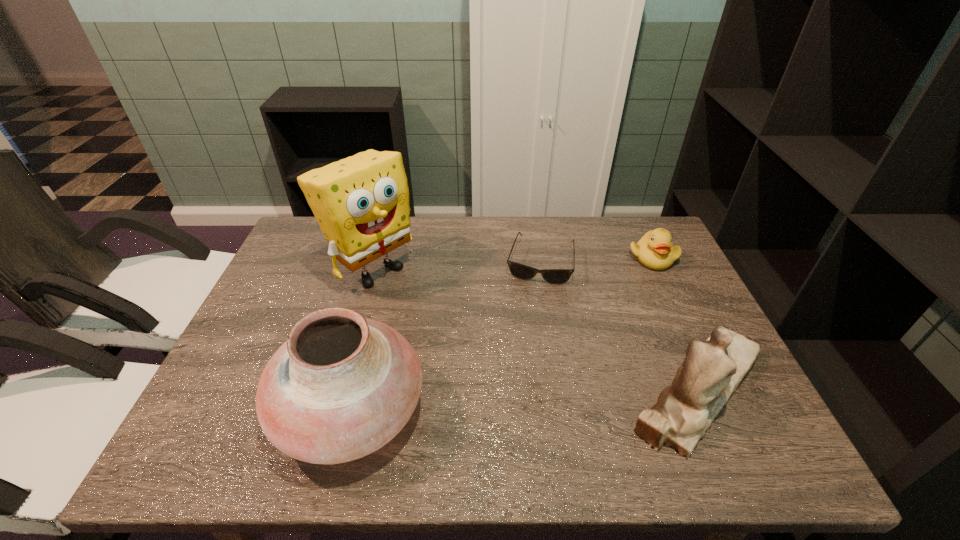
This screenshot has width=960, height=540. I want to click on pottery, so click(x=342, y=386).

You are a GUI agent. You are given a task and a screenshot of the screen. Output one action in this format:
    pyautogui.click(x=<x>, y=<y>)
    Task: Click on the third tallest object
    
    Given the screenshot: What is the action you would take?
    pyautogui.click(x=711, y=372)

The height and width of the screenshot is (540, 960). Find the location of `sponge`. sponge is located at coordinates (361, 203).

Locate an element on the screen. The image size is (960, 540). the shortest object is located at coordinates (553, 276).

In order to click on sunglasses in this screenshot , I will do `click(553, 276)`.

This screenshot has width=960, height=540. I want to click on duckling, so (x=654, y=250).

Find the location of `free space located 0.380m on the right of the second tallest object`. free space located 0.380m on the right of the second tallest object is located at coordinates (603, 410).

Find the location of a particular element. Image resolution: width=960 pixels, height=540 pixels. free space located 0.100m on the face of the tallest object is located at coordinates (423, 307).

Where is `free space located on the face of the tallest object`? The width and height of the screenshot is (960, 540). free space located on the face of the tallest object is located at coordinates (425, 309).

Locate an element on the screen. vacant space located on the face of the tallest object is located at coordinates (425, 309).